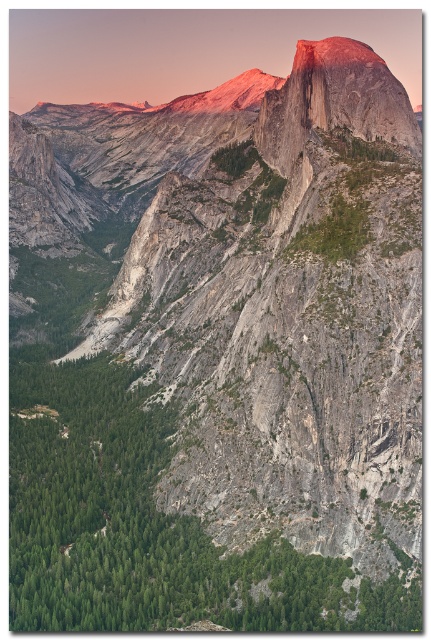
Question: Can you confirm if green rough rock at center is positioned below matte granite peak at center?

Choices:
 (A) yes
 (B) no

Answer: (A)

Question: Among these points, which one is nearest to the camera?

Choices:
 (A) (406, 115)
 (B) (68, 420)

Answer: (B)

Question: Which point is closer to the camera taking this photo?

Choices:
 (A) (369, 51)
 (B) (340, 573)

Answer: (B)

Question: Can you confirm if green rough rock at center is bigger than matte granite peak at center?

Choices:
 (A) no
 (B) yes

Answer: (B)

Question: Can you confirm if green rough rock at center is positioned to the left of matte granite peak at center?

Choices:
 (A) no
 (B) yes

Answer: (B)